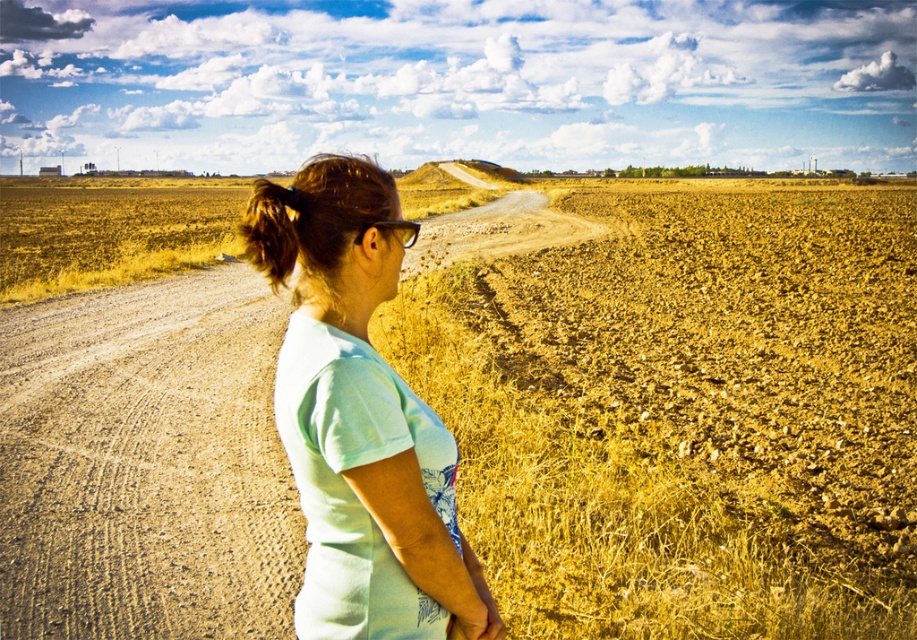
Question: Does brown gravel dirt track at left have a larger size compared to brown hair at left?

Choices:
 (A) no
 (B) yes

Answer: (A)

Question: Considering the relative positions of brown gravel dirt track at left and black plastic glasses at center in the image provided, where is brown gravel dirt track at left located with respect to black plastic glasses at center?

Choices:
 (A) above
 (B) below

Answer: (B)

Question: Among these points, which one is nearest to the camera?

Choices:
 (A) click(x=410, y=244)
 (B) click(x=269, y=262)
 (C) click(x=461, y=573)

Answer: (C)

Question: Does brown gravel dirt track at left have a smaller size compared to brown hair at left?

Choices:
 (A) no
 (B) yes

Answer: (B)

Question: Which point is farther from the camera taking this photo?

Choices:
 (A) 359,236
 (B) 260,269
 (C) 352,452

Answer: (B)

Question: Considering the real-world distances, which object is farthest from the brown hair at left?

Choices:
 (A) light blue t-shirt at center
 (B) black plastic glasses at center

Answer: (B)